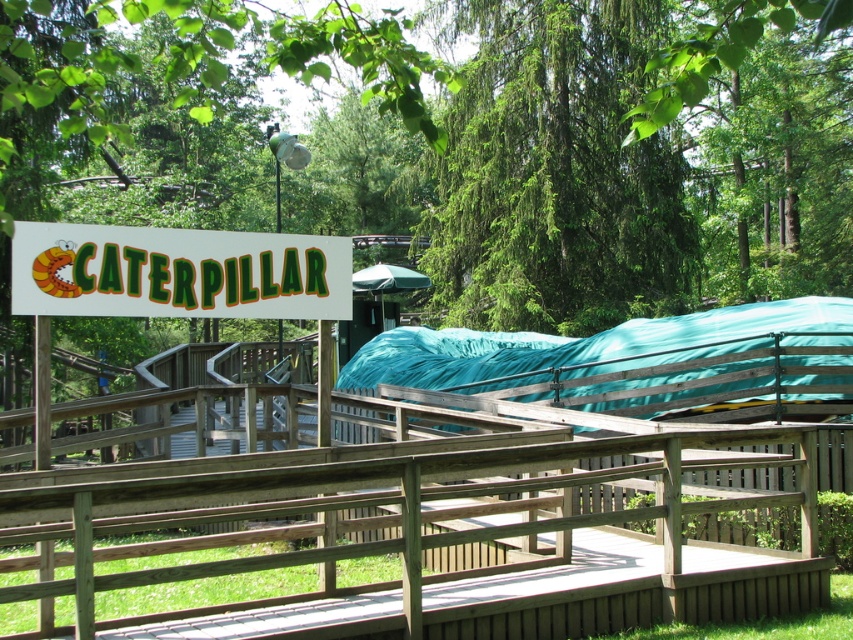
Is point (543, 243) positioned in front of point (65, 253)?

No, it is behind (65, 253).

Is point (461, 316) positioned behind point (53, 224)?

Yes, point (461, 316) is behind point (53, 224).

Identify the location of green leafy tree at upper center. The image size is (853, 640). (555, 173).

Is wooden rail at center wider than white plastic sign at upper left?

Indeed, wooden rail at center has a greater width compared to white plastic sign at upper left.

Is wooden rail at center bigger than white plastic sign at upper left?

Yes, wooden rail at center is bigger than white plastic sign at upper left.

What do you see at coordinates (433, 525) in the screenshot? I see `wooden rail at center` at bounding box center [433, 525].

Locate an element on the screen. The width and height of the screenshot is (853, 640). wooden rail at center is located at coordinates (433, 525).

Between wooden rail at center and green fabric canopy at center, which one is positioned higher?

green fabric canopy at center is above.

Is point (329, 504) behind point (378, 291)?

That is False.

The height and width of the screenshot is (640, 853). What are the coordinates of `wooden rail at center` in the screenshot? It's located at (433, 525).

Find the location of a particular element. The height and width of the screenshot is (640, 853). wooden rail at center is located at coordinates (433, 525).